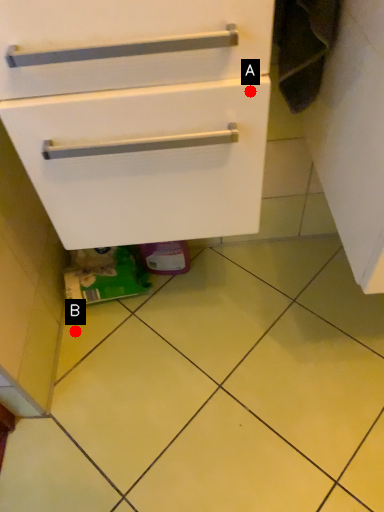
Question: Two points are circled on the image, labeled by A and B beside each circle. Among these points, which one is nearest to the camera?

Choices:
 (A) A is closer
 (B) B is closer

Answer: (A)